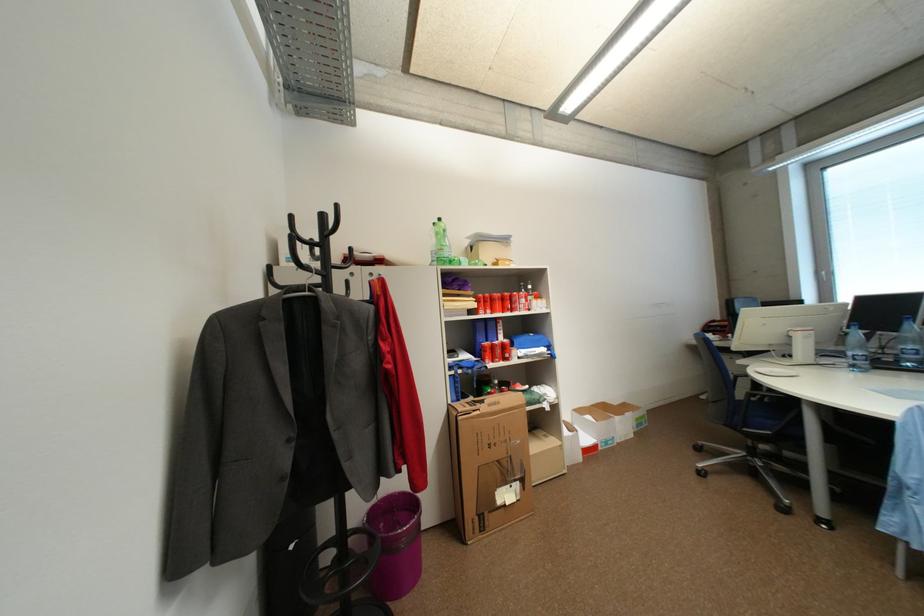
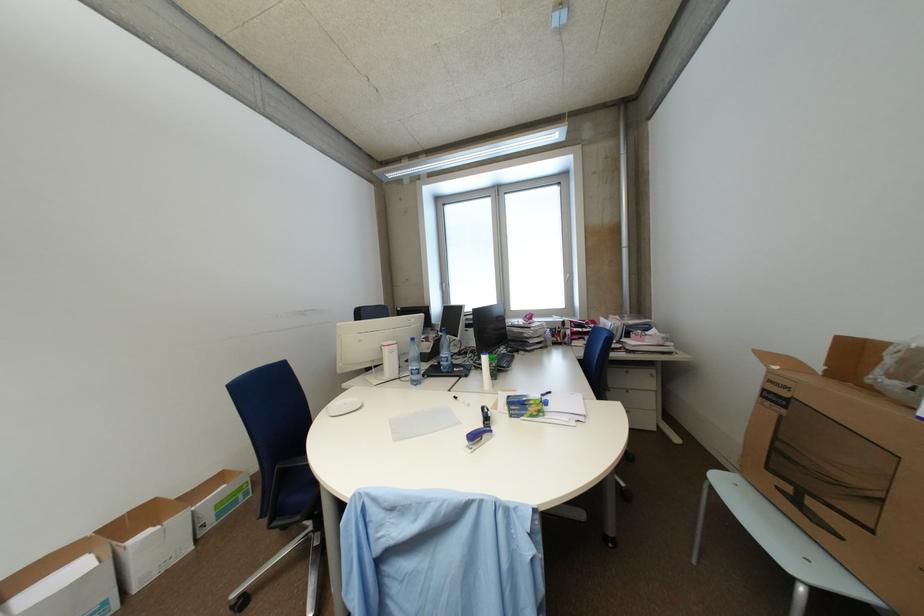
Locate, in the second image, the point that corresponds to point 800,334 in the first image.

(392, 350)